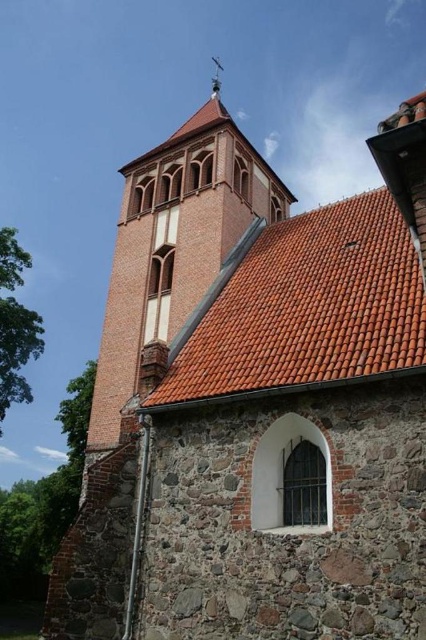
Based on the scene description, what does the point at coordinates (175,244) represent?

The point at coordinates (175,244) indicates the location of the light brown stone tower at center.

You are standing in front of the historic stone church and notice the orange clay tiles at upper center and the metallic spire at upper center. Which object is closer to you?

The orange clay tiles at upper center are closer to you because they are in front of the metallic spire at upper center.